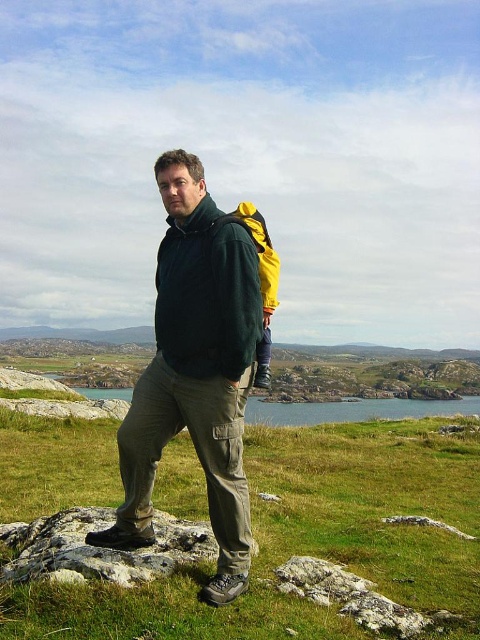
Question: Is matte green jacket at center smaller than gray rock at lower center?

Choices:
 (A) yes
 (B) no

Answer: (B)

Question: Which point is closer to the camera?

Choices:
 (A) gray rock at lower center
 (B) matte green jacket at center
 (C) green matte jacket at center

Answer: (A)

Question: Based on their relative distances, which object is farther from the matte green jacket at center?

Choices:
 (A) green matte jacket at center
 (B) gray rock at lower center
 (C) green matte grass at center

Answer: (C)

Question: Estimate the real-world distances between objects in this image. Which object is farther from the green water at center?

Choices:
 (A) green matte jacket at center
 (B) green matte grass at center

Answer: (A)

Question: Where is green matte jacket at center located in relation to gray rock at lower center in the image?

Choices:
 (A) below
 (B) above

Answer: (B)

Question: Does green matte jacket at center have a smaller size compared to gray rock at lower center?

Choices:
 (A) no
 (B) yes

Answer: (A)